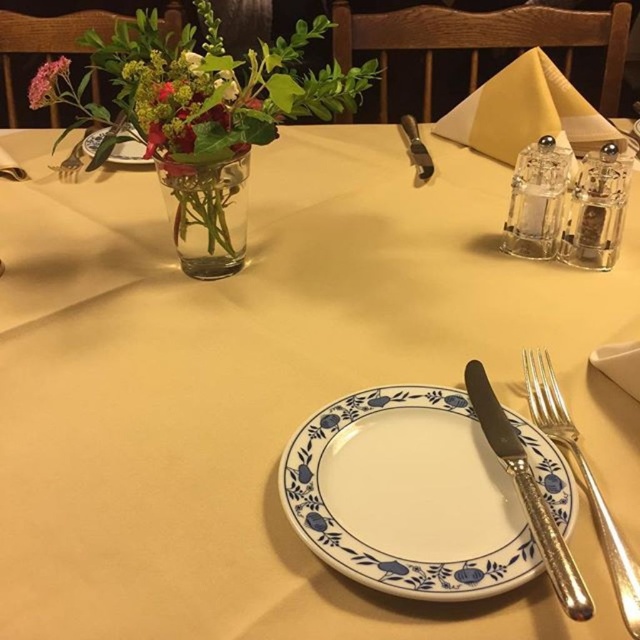
You are a server arranging the dining table. You have the silver metallic fork at right and the white porcelain plate at upper center. Which object takes up more space on the table?

The white porcelain plate at upper center takes up more space than the silver metallic fork at right.

You are a server arranging cutlery on a dining table. You have a silver metallic fork at right and a white porcelain plate at upper center. Which item is narrower in width?

The silver metallic fork at right has a lesser width compared to the white porcelain plate at upper center, so the silver metallic fork at right is narrower.